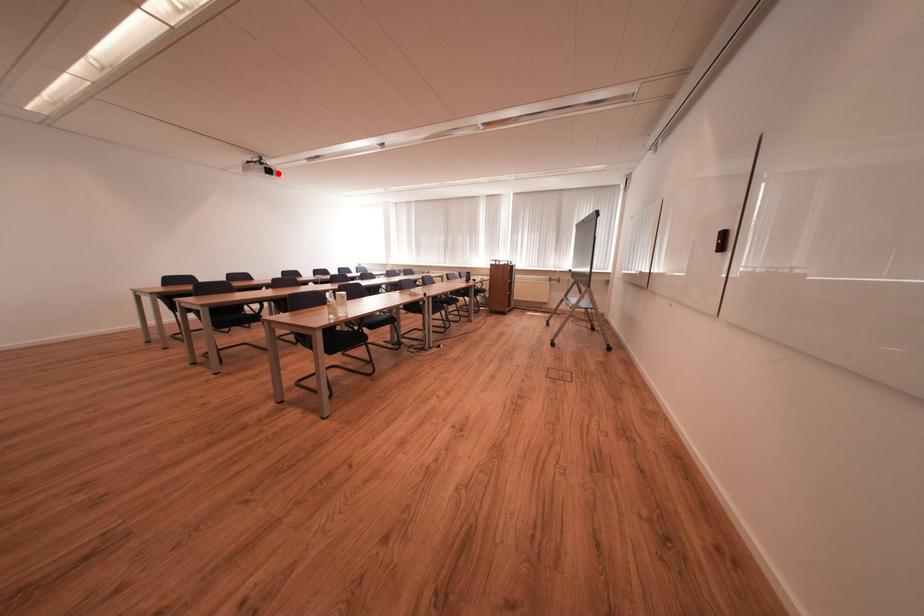
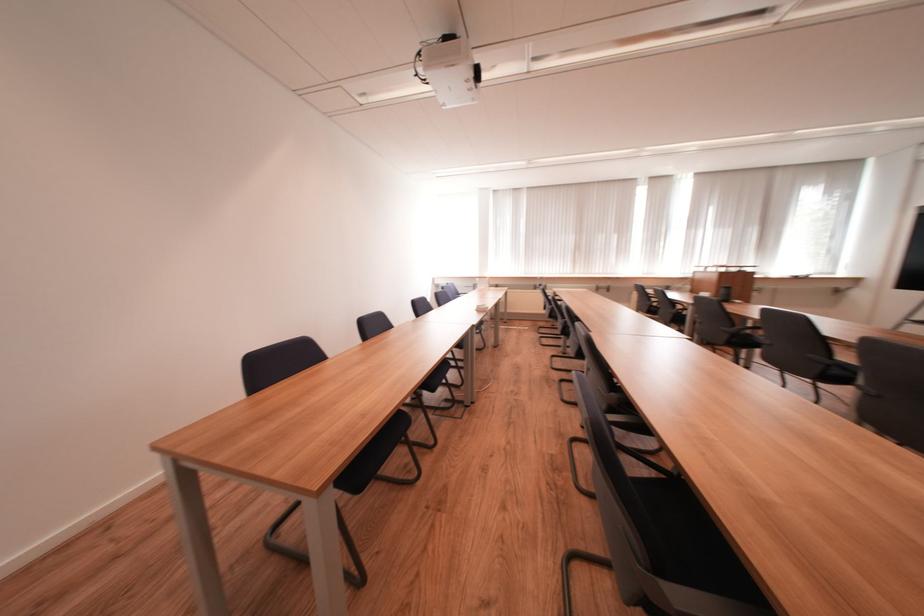
In the second image, find the point that corresponds to the highlighted location in the first image.

(485, 75)